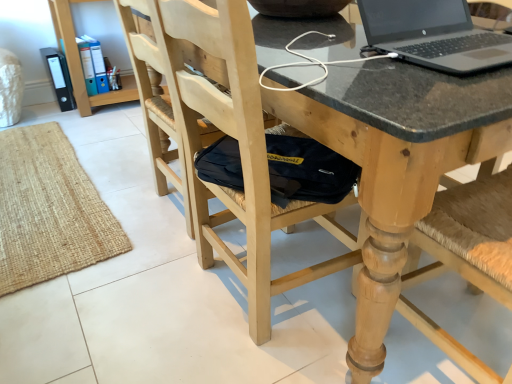
Question: Is black glossy laptop at upper right positioned far away from wooden chair at center, the first chair when ordered from right to left?

Choices:
 (A) yes
 (B) no

Answer: (B)

Question: Is black glossy laptop at upper right further to the viewer compared to wooden chair at center, the second chair in the left-to-right sequence?

Choices:
 (A) yes
 (B) no

Answer: (A)

Question: From a real-world perspective, is black glossy laptop at upper right on top of wooden chair at center, the second chair in the left-to-right sequence?

Choices:
 (A) yes
 (B) no

Answer: (A)

Question: Does black glossy laptop at upper right have a lesser width compared to wooden chair at center, the second chair in the left-to-right sequence?

Choices:
 (A) no
 (B) yes

Answer: (A)

Question: Is black glossy laptop at upper right at the right side of wooden chair at center, the second chair in the left-to-right sequence?

Choices:
 (A) no
 (B) yes

Answer: (A)

Question: Is black glossy laptop at upper right facing away from wooden chair at center, the second chair in the left-to-right sequence?

Choices:
 (A) no
 (B) yes

Answer: (A)

Question: Is black glossy laptop at upper right next to matte black folders at upper left and touching it?

Choices:
 (A) yes
 (B) no

Answer: (B)

Question: Is matte black folders at upper left completely or partially inside black glossy laptop at upper right?

Choices:
 (A) yes
 (B) no

Answer: (B)

Question: From a real-world perspective, is black glossy laptop at upper right positioned under matte black folders at upper left based on gravity?

Choices:
 (A) no
 (B) yes

Answer: (A)

Question: Considering the relative sizes of black glossy laptop at upper right and matte black folders at upper left in the image provided, is black glossy laptop at upper right bigger than matte black folders at upper left?

Choices:
 (A) no
 (B) yes

Answer: (A)

Question: Considering the relative sizes of black glossy laptop at upper right and matte black folders at upper left in the image provided, is black glossy laptop at upper right taller than matte black folders at upper left?

Choices:
 (A) yes
 (B) no

Answer: (B)

Question: Is black glossy laptop at upper right positioned with its back to matte black folders at upper left?

Choices:
 (A) yes
 (B) no

Answer: (A)

Question: Is natural wood chair at center, which is the second chair in right-to-left order, wider than matte black folders at upper left?

Choices:
 (A) yes
 (B) no

Answer: (A)